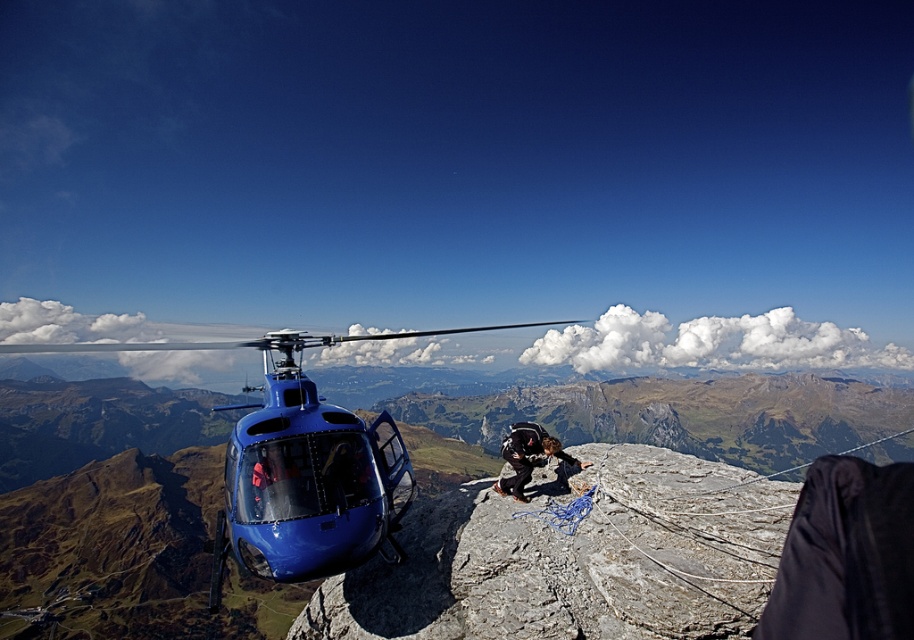
Question: Is blue glossy helicopter at center smaller than black fabric jacket at center?

Choices:
 (A) yes
 (B) no

Answer: (B)

Question: Can you confirm if rough textured rock at center is positioned below blue glossy helicopter at center?

Choices:
 (A) yes
 (B) no

Answer: (B)

Question: Which object is farther from the camera taking this photo?

Choices:
 (A) black fabric jacket at center
 (B) rough textured rock at center

Answer: (A)

Question: Does rough textured rock at center appear on the left side of black fabric jacket at center?

Choices:
 (A) no
 (B) yes

Answer: (B)

Question: Which point is farther from the camera taking this photo?

Choices:
 (A) click(421, 541)
 (B) click(300, 424)
 (C) click(522, 438)

Answer: (A)

Question: Among these points, which one is farthest from the camera?

Choices:
 (A) (519, 464)
 (B) (327, 536)
 (C) (452, 627)

Answer: (A)